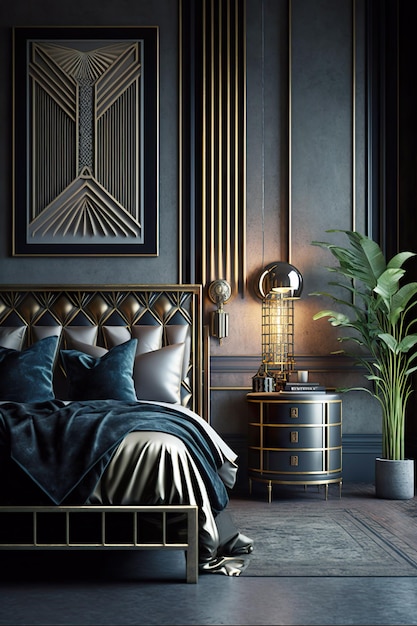
Locate an element on the screen. This screenshot has width=417, height=626. bed is located at coordinates (124, 448).